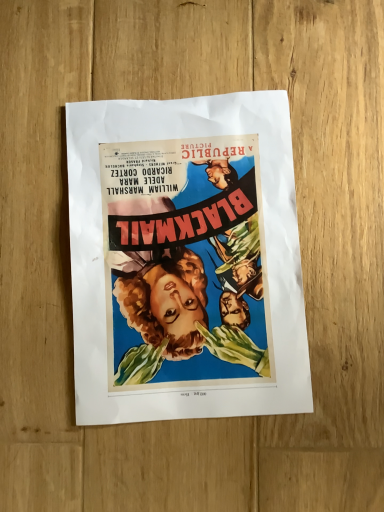
At what (x,y) coordinates should I click in order to perform the action: click on matte paper poster at center. Please return your answer as a coordinate pair (x, y). Image resolution: width=384 pixels, height=512 pixels. Looking at the image, I should click on (185, 259).

Describe the element at coordinates (185, 259) in the screenshot. The height and width of the screenshot is (512, 384). I see `matte paper poster at center` at that location.

Where is `matte paper poster at center`? The image size is (384, 512). matte paper poster at center is located at coordinates (185, 259).